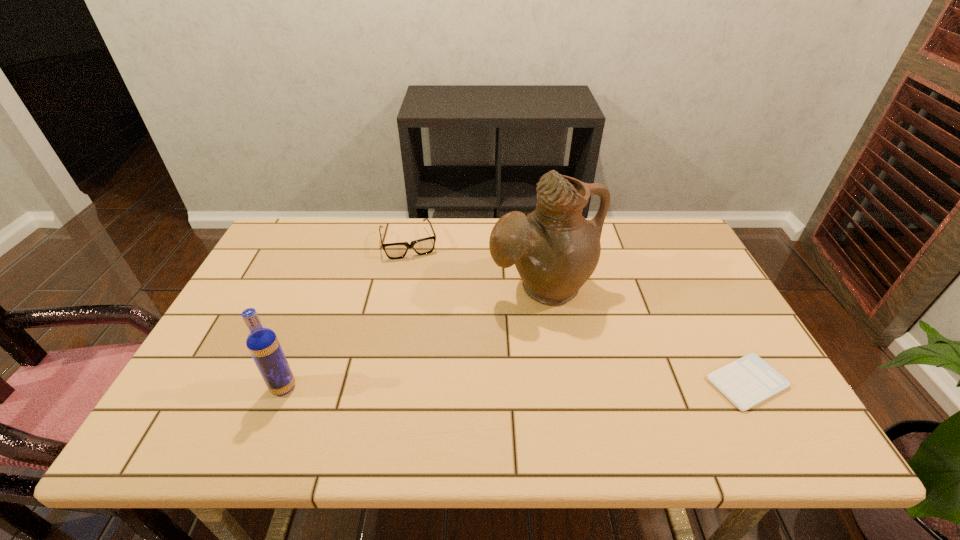
Image resolution: width=960 pixels, height=540 pixels. In order to click on blank area located at the spout of the tallest object in this screenshot , I will do `click(581, 384)`.

Locate an element on the screen. vacant space situated 0.260m at the spout of the tallest object is located at coordinates coord(588,403).

The width and height of the screenshot is (960, 540). Identify the location of free region located 0.230m at the spout of the tallest object. (583, 392).

Locate an element on the screen. blank space located 0.090m on the front-facing side of the sunglasses is located at coordinates (419, 279).

Image resolution: width=960 pixels, height=540 pixels. Find the location of `vacant space located 0.310m on the front-facing side of the sunglasses`. vacant space located 0.310m on the front-facing side of the sunglasses is located at coordinates tap(434, 333).

Where is `vacant space located on the front-facing side of the sunglasses`? The height and width of the screenshot is (540, 960). vacant space located on the front-facing side of the sunglasses is located at coordinates (424, 299).

Find the location of `pitcher present at the far edge`. pitcher present at the far edge is located at coordinates (555, 249).

The image size is (960, 540). Find the location of `sunglasses present at the far edge`. sunglasses present at the far edge is located at coordinates (423, 246).

Identify the location of vodka that is at the near edge. (262, 343).

Image resolution: width=960 pixels, height=540 pixels. Find the location of `calculator present at the near edge`. calculator present at the near edge is located at coordinates (748, 381).